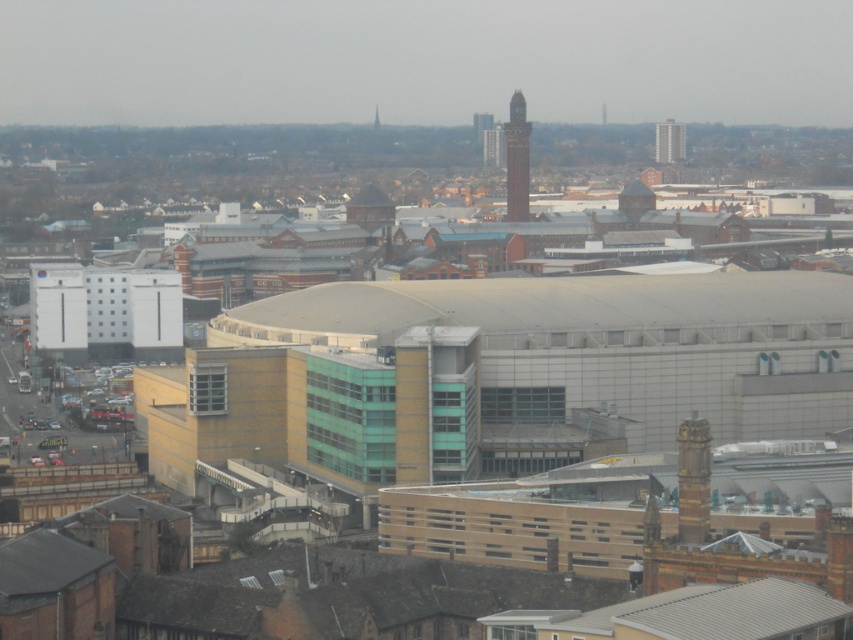
Question: Does brown brick clock tower at upper center have a greater width compared to smooth glass skyscraper at upper right?

Choices:
 (A) no
 (B) yes

Answer: (A)

Question: Is smooth glass skyscraper at upper right below brick tower at upper center?

Choices:
 (A) yes
 (B) no

Answer: (B)

Question: Which of the following is the farthest from the observer?

Choices:
 (A) (664, 124)
 (B) (520, 193)

Answer: (A)

Question: Which object appears closest to the camera in this image?

Choices:
 (A) smooth glass skyscraper at upper right
 (B) brown brick clock tower at upper center
 (C) brick tower at upper center

Answer: (B)

Question: Can you confirm if brown brick clock tower at upper center is wider than brick tower at upper center?

Choices:
 (A) no
 (B) yes

Answer: (A)

Question: Which point is farther from the camera taking this photo?

Choices:
 (A) (502, 154)
 (B) (671, 156)
 (C) (506, 182)

Answer: (B)